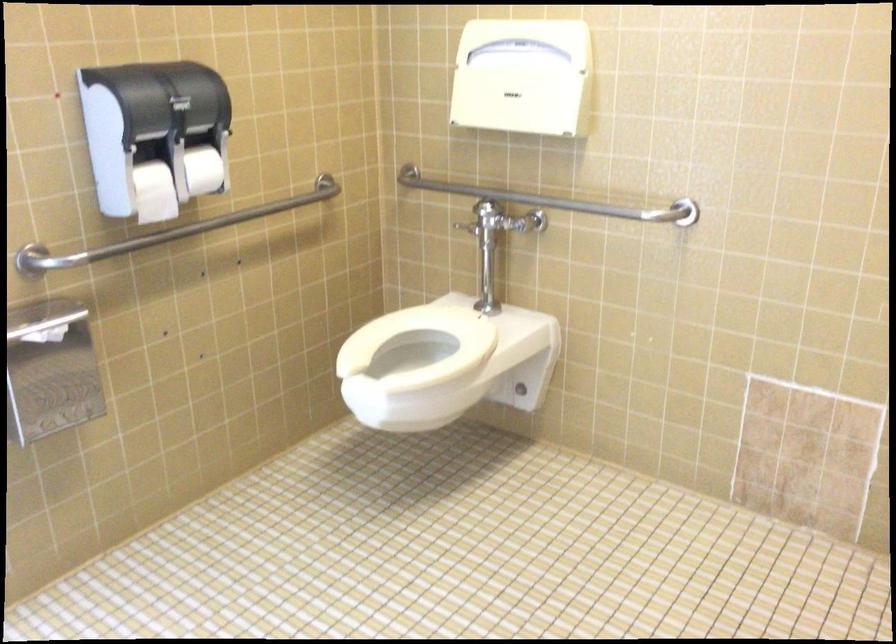
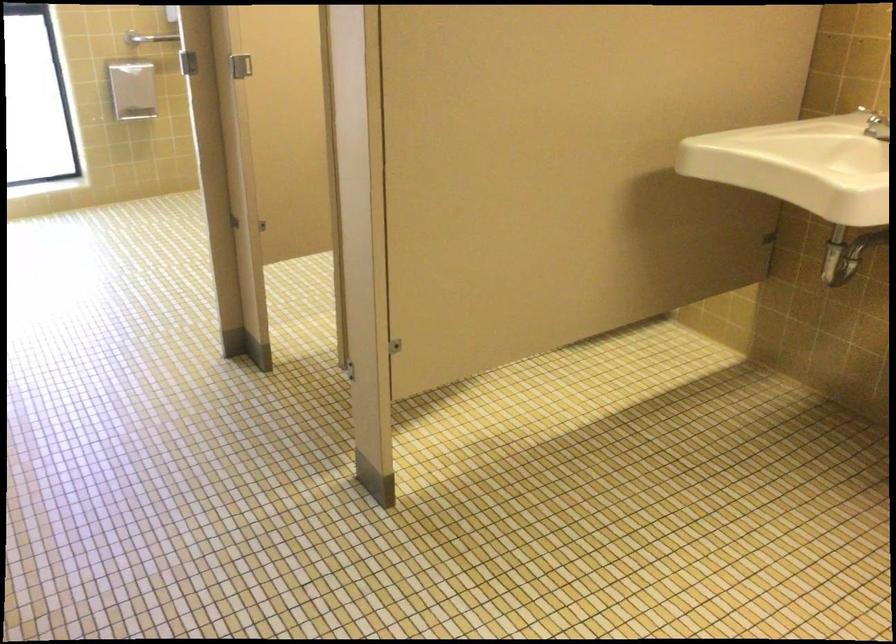
Where in the second image is the point corresponding to point 110,257 from the first image?

(149, 38)